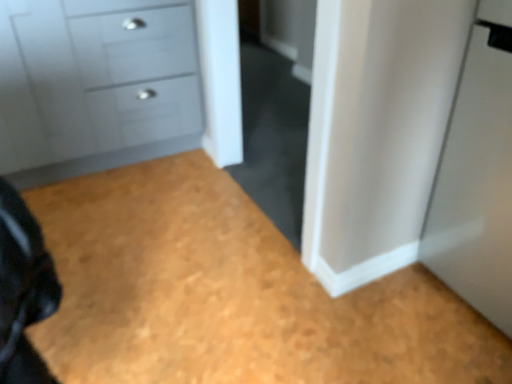
Question: Is wooden floor at lower left located outside matte gray chest of drawers at upper left?

Choices:
 (A) yes
 (B) no

Answer: (A)

Question: From a real-world perspective, is wooden floor at lower left under matte gray chest of drawers at upper left?

Choices:
 (A) yes
 (B) no

Answer: (A)

Question: From the image's perspective, would you say wooden floor at lower left is shown under matte gray chest of drawers at upper left?

Choices:
 (A) no
 (B) yes

Answer: (B)

Question: Does wooden floor at lower left contain matte gray chest of drawers at upper left?

Choices:
 (A) no
 (B) yes

Answer: (A)

Question: Is wooden floor at lower left positioned before matte gray chest of drawers at upper left?

Choices:
 (A) yes
 (B) no

Answer: (A)

Question: Are wooden floor at lower left and matte gray chest of drawers at upper left far apart?

Choices:
 (A) no
 (B) yes

Answer: (A)

Question: From the image's perspective, does matte gray chest of drawers at upper left appear lower than wooden floor at lower left?

Choices:
 (A) no
 (B) yes

Answer: (A)

Question: Is wooden floor at lower left inside matte gray chest of drawers at upper left?

Choices:
 (A) no
 (B) yes

Answer: (A)

Question: From the image's perspective, would you say matte gray chest of drawers at upper left is positioned over wooden floor at lower left?

Choices:
 (A) yes
 (B) no

Answer: (A)

Question: Is matte gray chest of drawers at upper left behind wooden floor at lower left?

Choices:
 (A) yes
 (B) no

Answer: (A)

Question: Are matte gray chest of drawers at upper left and wooden floor at lower left located far from each other?

Choices:
 (A) no
 (B) yes

Answer: (A)

Question: Is wooden floor at lower left at the back of matte gray chest of drawers at upper left?

Choices:
 (A) no
 (B) yes

Answer: (A)

Question: Considering the positions of matte gray chest of drawers at upper left and wooden floor at lower left in the image, is matte gray chest of drawers at upper left bigger or smaller than wooden floor at lower left?

Choices:
 (A) big
 (B) small

Answer: (A)